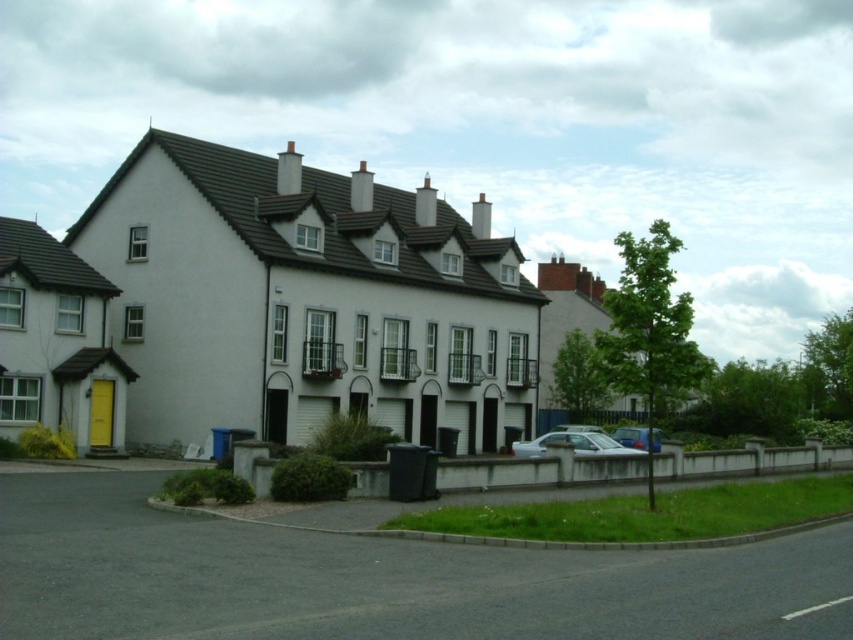
You are standing at the corner of the street and want to park your car in the spot where the silver metallic car at center is currently parked. What are the coordinates of the parking spot you should aim for?

The coordinates of the parking spot where the silver metallic car at center is located are at point [573,444].